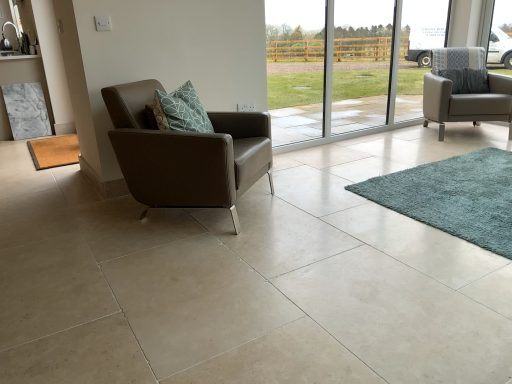
At what (x,y) coordinates should I click in order to perform the action: click on free region under transparent glass door at center (from a real-world perspective). Please return your answer as a coordinate pair (x, y). Looking at the image, I should click on (365, 133).